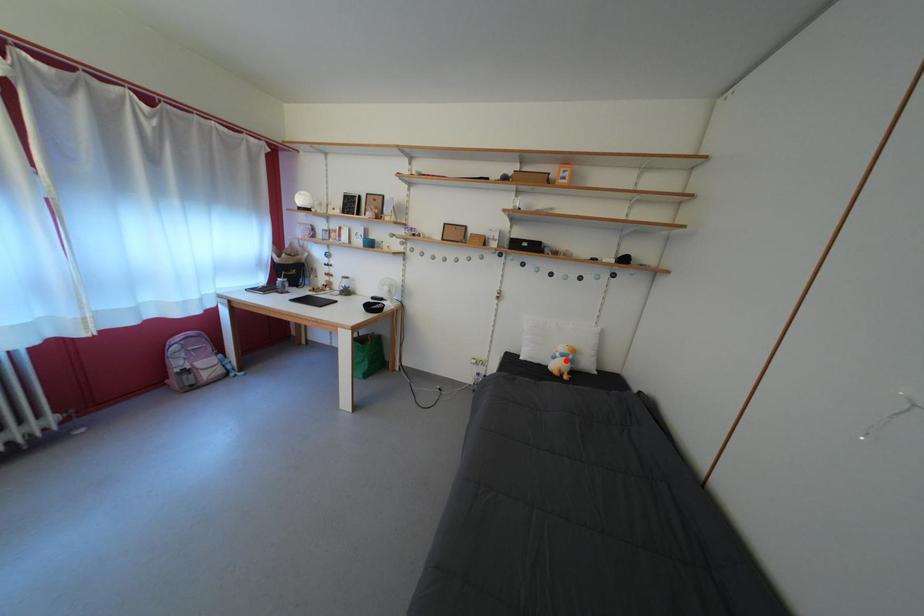
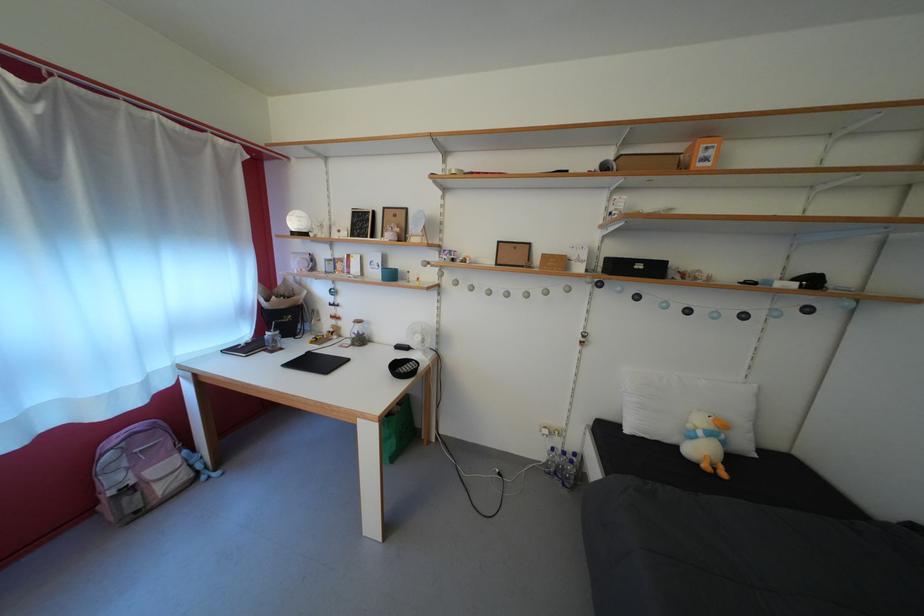
Find the pixel in the second image that matches the highlighted location in the first image.

(709, 439)